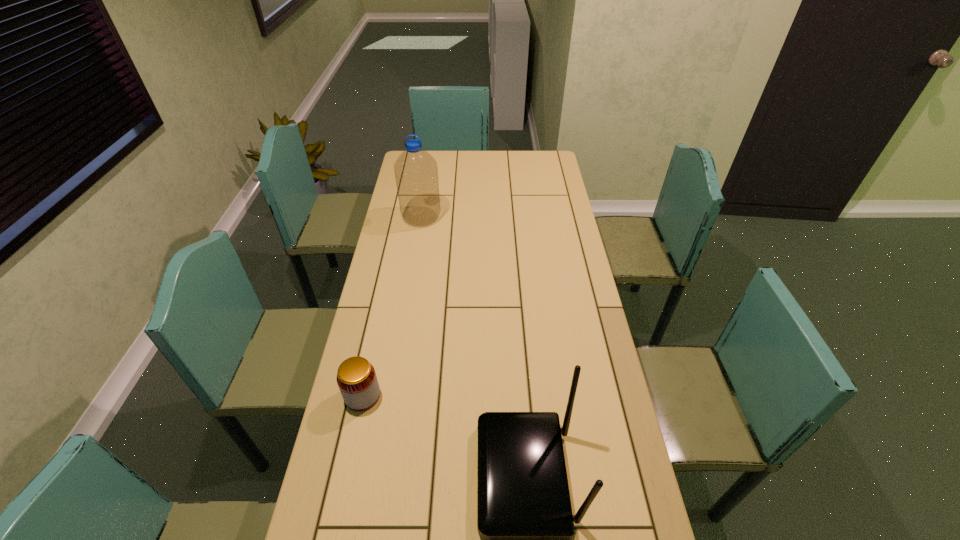
This screenshot has height=540, width=960. In order to click on the tallest object in this screenshot , I will do `click(416, 172)`.

Image resolution: width=960 pixels, height=540 pixels. Identify the location of water jug. (416, 172).

Where is `the shortest object`? Image resolution: width=960 pixels, height=540 pixels. the shortest object is located at coordinates (356, 377).

Locate an element on the screen. This screenshot has width=960, height=540. jar is located at coordinates (356, 377).

You are a GUI agent. You are given a task and a screenshot of the screen. Output one action in this format:
    pyautogui.click(x=<x>, y=<y>)
    Task: Click on the free region located on the back of the farthest object
    Image resolution: width=960 pixels, height=540 pixels.
    Given the screenshot: What is the action you would take?
    pyautogui.click(x=424, y=198)

This screenshot has height=540, width=960. In order to click on free space located on the right of the second nearest object in this screenshot , I will do `click(479, 396)`.

You are a GUI agent. You are given a task and a screenshot of the screen. Output one action in this format:
    pyautogui.click(x=<x>, y=<y>)
    Task: Click on the water jug that is at the left edge
    
    Given the screenshot: What is the action you would take?
    pyautogui.click(x=416, y=172)

Identify the location of jar situated at the left edge. The width and height of the screenshot is (960, 540). (356, 377).

Identify the location of vacant space at the far edge of the desktop. (457, 173).

In the image, there is a desktop. Identify the location of free region at the left edge. (339, 522).